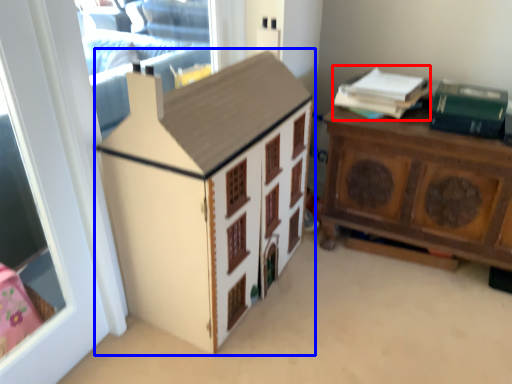
Question: Which point is closer to the camera, book (highlighted by a red box) or cabinetry (highlighted by a blue box)?

Choices:
 (A) book
 (B) cabinetry

Answer: (B)